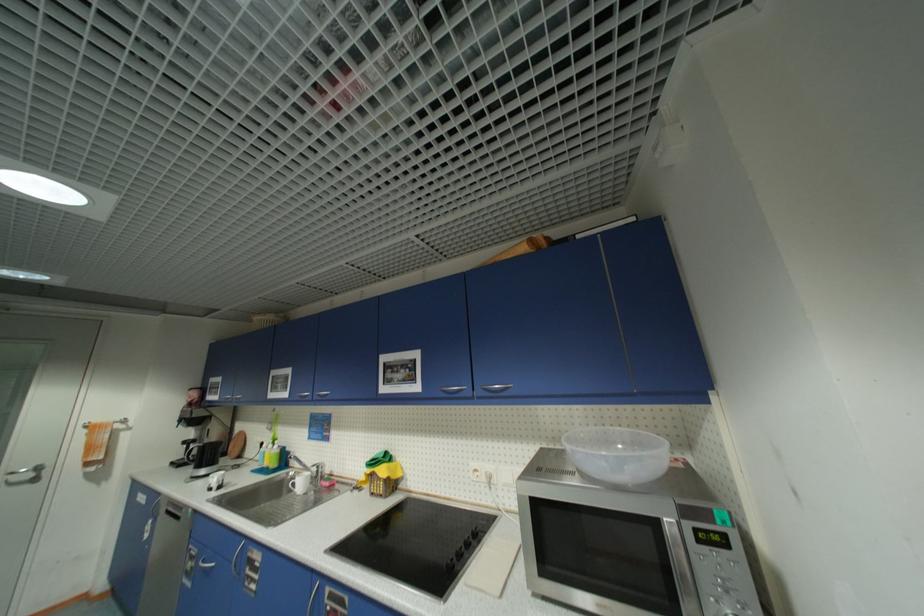
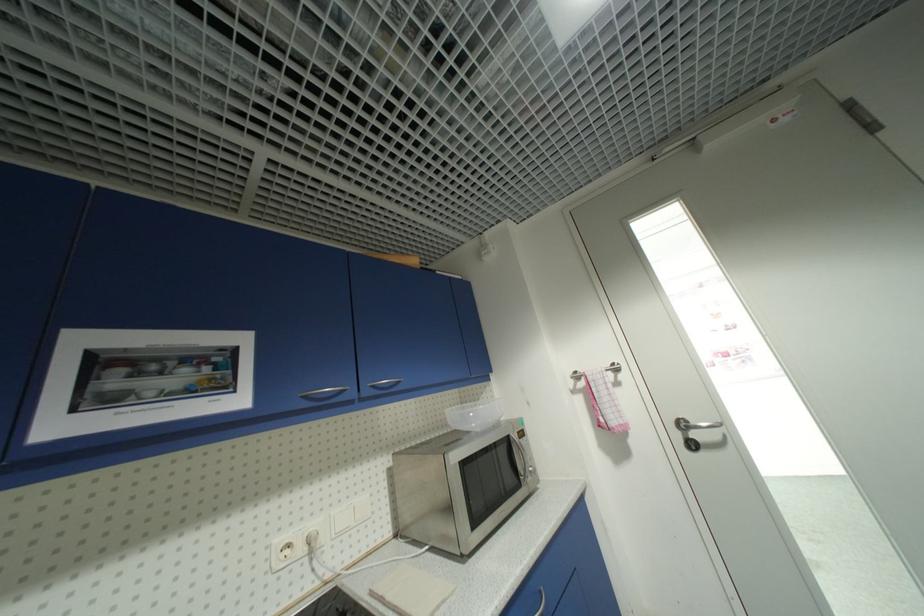
In the second image, find the point that corresponds to point (481, 472) in the first image.

(294, 546)